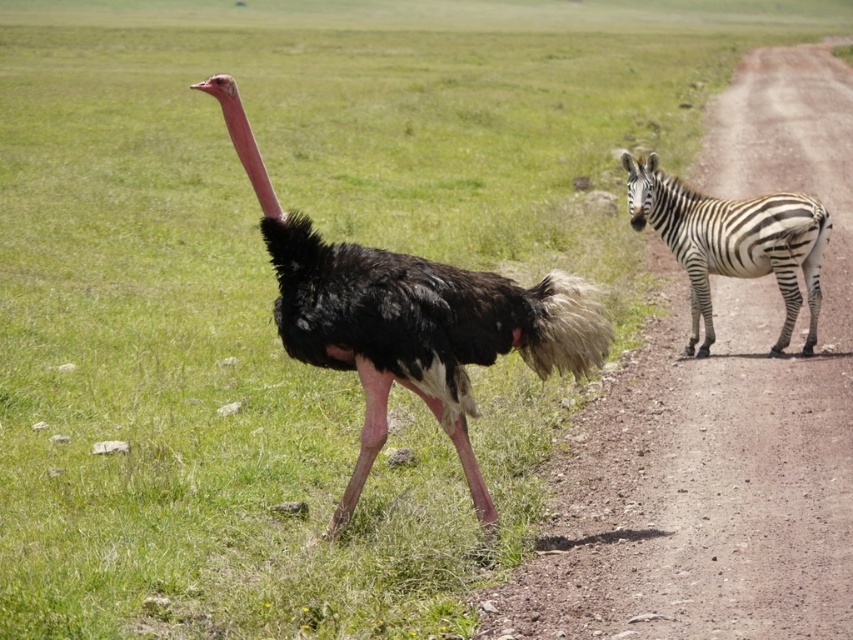
Which is more to the right, dirttrack at right or black and white stripes at right?

From the viewer's perspective, dirttrack at right appears more on the right side.

Is dirttrack at right wider than black and white stripes at right?

Yes.

Locate an element on the screen. dirttrack at right is located at coordinates click(x=718, y=420).

This screenshot has width=853, height=640. In order to click on dirttrack at right in this screenshot , I will do click(718, 420).

Between point (532, 330) and point (651, 168), which one is positioned behind?

The point (651, 168) is more distant.

Is point (287, 314) positioned behind point (628, 193)?

That is False.

Where is `black feathered ostrich at center`? The image size is (853, 640). black feathered ostrich at center is located at coordinates [408, 320].

Does black and white striped zebra at right have a lesser height compared to black and white stripes at right?

In fact, black and white striped zebra at right may be taller than black and white stripes at right.

Can you confirm if black and white striped zebra at right is positioned to the right of black and white stripes at right?

Indeed, black and white striped zebra at right is positioned on the right side of black and white stripes at right.

Image resolution: width=853 pixels, height=640 pixels. Describe the element at coordinates (732, 243) in the screenshot. I see `black and white striped zebra at right` at that location.

The width and height of the screenshot is (853, 640). Identify the location of black and white striped zebra at right. (732, 243).